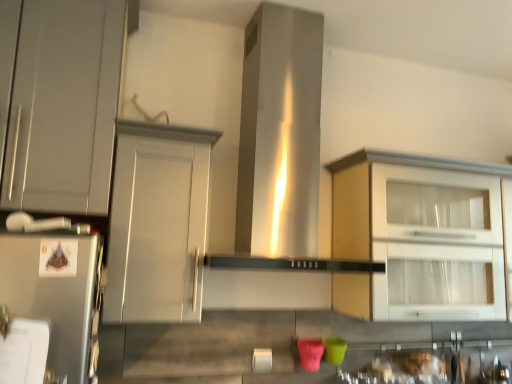
Image resolution: width=512 pixels, height=384 pixels. Describe the element at coordinates (64, 106) in the screenshot. I see `matte gray cabinet at left, which ranks as the 3th cabinetry in right-to-left order` at that location.

I want to click on matte white cabinet at right, placed as the 3th cabinetry when sorted from left to right, so 414,233.

Image resolution: width=512 pixels, height=384 pixels. What do you see at coordinates (414, 233) in the screenshot? I see `matte white cabinet at right, placed as the 3th cabinetry when sorted from left to right` at bounding box center [414, 233].

Find the location of a particular element. Image resolution: width=512 pixels, height=384 pixels. matte gray cabinet at left, the first cabinetry from the left is located at coordinates (64, 106).

Is stainless steel vent at center positioned far away from matte white cabinet at right, which is the first cabinetry from right to left?

No, stainless steel vent at center is in close proximity to matte white cabinet at right, which is the first cabinetry from right to left.

Is stainless steel vent at center aimed at matte white cabinet at right, placed as the 3th cabinetry when sorted from left to right?

No, stainless steel vent at center is not turned towards matte white cabinet at right, placed as the 3th cabinetry when sorted from left to right.

From the image's perspective, between stainless steel vent at center and matte white cabinet at right, placed as the 3th cabinetry when sorted from left to right, which one is located above?

From the image's view, stainless steel vent at center is above.

From a real-world perspective, is stainless steel vent at center physically below matte white cabinet at right, which is the first cabinetry from right to left?

No, from a real-world perspective, stainless steel vent at center is not below matte white cabinet at right, which is the first cabinetry from right to left.

Is matte gray cabinet at center, positioned as the second cabinetry in right-to-left order, located outside matte white cabinet at right, placed as the 3th cabinetry when sorted from left to right?

Yes, matte gray cabinet at center, positioned as the second cabinetry in right-to-left order, is located beyond the bounds of matte white cabinet at right, placed as the 3th cabinetry when sorted from left to right.

From the image's perspective, is matte gray cabinet at center, positioned as the 2th cabinetry in left-to-right order, under matte white cabinet at right, placed as the 3th cabinetry when sorted from left to right?

Actually, matte gray cabinet at center, positioned as the 2th cabinetry in left-to-right order, appears above matte white cabinet at right, placed as the 3th cabinetry when sorted from left to right, in the image.

What's the angular difference between matte gray cabinet at center, positioned as the second cabinetry in right-to-left order, and matte white cabinet at right, placed as the 3th cabinetry when sorted from left to right,'s facing directions?

2.21 degrees separate the facing orientations of matte gray cabinet at center, positioned as the second cabinetry in right-to-left order, and matte white cabinet at right, placed as the 3th cabinetry when sorted from left to right.

From the image's perspective, is matte gray cabinet at left, which ranks as the 3th cabinetry in right-to-left order, positioned above or below matte white cabinet at right, which is the first cabinetry from right to left?

matte gray cabinet at left, which ranks as the 3th cabinetry in right-to-left order, is above matte white cabinet at right, which is the first cabinetry from right to left.

Does matte gray cabinet at left, which ranks as the 3th cabinetry in right-to-left order, contain matte white cabinet at right, placed as the 3th cabinetry when sorted from left to right?

No, matte gray cabinet at left, which ranks as the 3th cabinetry in right-to-left order, does not contain matte white cabinet at right, placed as the 3th cabinetry when sorted from left to right.

From a real-world perspective, is matte gray cabinet at left, which ranks as the 3th cabinetry in right-to-left order, located higher than matte white cabinet at right, placed as the 3th cabinetry when sorted from left to right?

Correct, in the physical world, matte gray cabinet at left, which ranks as the 3th cabinetry in right-to-left order, is higher than matte white cabinet at right, placed as the 3th cabinetry when sorted from left to right.

Considering the positions of objects matte gray cabinet at left, the first cabinetry from the left, and matte white cabinet at right, placed as the 3th cabinetry when sorted from left to right, in the image provided, who is more to the right, matte gray cabinet at left, the first cabinetry from the left, or matte white cabinet at right, placed as the 3th cabinetry when sorted from left to right,?

matte white cabinet at right, placed as the 3th cabinetry when sorted from left to right, is more to the right.

The image size is (512, 384). Find the location of `the 1st cabinetry behind the matte gray cabinet at left, which ranks as the 3th cabinetry in right-to-left order`. the 1st cabinetry behind the matte gray cabinet at left, which ranks as the 3th cabinetry in right-to-left order is located at coordinates (158, 223).

Considering the relative sizes of matte gray cabinet at left, which ranks as the 3th cabinetry in right-to-left order, and matte gray cabinet at center, positioned as the second cabinetry in right-to-left order, in the image provided, is matte gray cabinet at left, which ranks as the 3th cabinetry in right-to-left order, smaller than matte gray cabinet at center, positioned as the second cabinetry in right-to-left order,?

Incorrect, matte gray cabinet at left, which ranks as the 3th cabinetry in right-to-left order, is not smaller in size than matte gray cabinet at center, positioned as the second cabinetry in right-to-left order.

Can you confirm if matte gray cabinet at left, which ranks as the 3th cabinetry in right-to-left order, is positioned to the left of matte gray cabinet at center, positioned as the second cabinetry in right-to-left order?

Yes.

From the picture: From the image's perspective, is matte gray cabinet at left, the first cabinetry from the left, located above or below matte gray cabinet at center, positioned as the second cabinetry in right-to-left order?

From the image's perspective, matte gray cabinet at left, the first cabinetry from the left, appears above matte gray cabinet at center, positioned as the second cabinetry in right-to-left order.

At what (x,y) coordinates should I click in order to perform the action: click on cabinetry behind the matte gray cabinet at center, positioned as the second cabinetry in right-to-left order. Please return your answer as a coordinate pair (x, y). Image resolution: width=512 pixels, height=384 pixels. Looking at the image, I should click on (414, 233).

Is matte white cabinet at right, placed as the 3th cabinetry when sorted from left to right, at the left side of matte gray cabinet at center, positioned as the second cabinetry in right-to-left order?

No.

Between point (436, 247) and point (129, 249), which one is positioned in front?

The point (129, 249) is more forward.

What's the angular difference between matte white cabinet at right, placed as the 3th cabinetry when sorted from left to right, and matte gray cabinet at center, positioned as the second cabinetry in right-to-left order,'s facing directions?

The angle between the facing direction of matte white cabinet at right, placed as the 3th cabinetry when sorted from left to right, and the facing direction of matte gray cabinet at center, positioned as the second cabinetry in right-to-left order, is 2.21 degrees.

From the image's perspective, between matte gray cabinet at left, the first cabinetry from the left, and stainless steel vent at center, which one is located above?

matte gray cabinet at left, the first cabinetry from the left, appears higher in the image.

Would you say matte gray cabinet at left, the first cabinetry from the left, is to the left or to the right of stainless steel vent at center in the picture?

From the image, it's evident that matte gray cabinet at left, the first cabinetry from the left, is to the left of stainless steel vent at center.

Considering the sizes of matte gray cabinet at left, the first cabinetry from the left, and stainless steel vent at center in the image, is matte gray cabinet at left, the first cabinetry from the left, taller or shorter than stainless steel vent at center?

In the image, matte gray cabinet at left, the first cabinetry from the left, appears to be shorter than stainless steel vent at center.

Locate an element on the screen. vent that appears below the matte gray cabinet at left, which ranks as the 3th cabinetry in right-to-left order (from the image's perspective) is located at coordinates (280, 133).

Can you confirm if stainless steel vent at center is positioned to the left of matte gray cabinet at left, which ranks as the 3th cabinetry in right-to-left order?

In fact, stainless steel vent at center is to the right of matte gray cabinet at left, which ranks as the 3th cabinetry in right-to-left order.

Considering the positions of objects stainless steel vent at center and matte gray cabinet at left, the first cabinetry from the left, in the image provided, who is behind, stainless steel vent at center or matte gray cabinet at left, the first cabinetry from the left,?

stainless steel vent at center is further from the camera.

Considering the sizes of objects stainless steel vent at center and matte gray cabinet at left, which ranks as the 3th cabinetry in right-to-left order, in the image provided, who is bigger, stainless steel vent at center or matte gray cabinet at left, which ranks as the 3th cabinetry in right-to-left order,?

stainless steel vent at center is bigger.

Considering the relative sizes of stainless steel vent at center and matte gray cabinet at left, the first cabinetry from the left, in the image provided, is stainless steel vent at center wider than matte gray cabinet at left, the first cabinetry from the left,?

Yes, stainless steel vent at center is wider than matte gray cabinet at left, the first cabinetry from the left.

You are a GUI agent. You are given a task and a screenshot of the screen. Output one action in this format:
    pyautogui.click(x=<x>, y=<y>)
    Task: Click on the vent on the left of matte white cabinet at right, which is the first cabinetry from right to left
    This screenshot has height=384, width=512.
    Given the screenshot: What is the action you would take?
    pyautogui.click(x=280, y=133)

Find the location of a particular element. The width and height of the screenshot is (512, 384). cabinetry behind the matte gray cabinet at center, positioned as the second cabinetry in right-to-left order is located at coordinates (414, 233).

When comparing their distances from matte white cabinet at right, placed as the 3th cabinetry when sorted from left to right, does matte gray cabinet at left, the first cabinetry from the left, or stainless steel vent at center seem closer?

stainless steel vent at center is closer to matte white cabinet at right, placed as the 3th cabinetry when sorted from left to right.

Which object lies further to the anchor point matte gray cabinet at left, which ranks as the 3th cabinetry in right-to-left order, stainless steel vent at center or matte white cabinet at right, which is the first cabinetry from right to left?

The object further to matte gray cabinet at left, which ranks as the 3th cabinetry in right-to-left order, is matte white cabinet at right, which is the first cabinetry from right to left.

Estimate the real-world distances between objects in this image. Which object is further from matte gray cabinet at left, the first cabinetry from the left, matte white cabinet at right, which is the first cabinetry from right to left, or stainless steel vent at center?

matte white cabinet at right, which is the first cabinetry from right to left.

From the image, which object appears to be farther from matte gray cabinet at center, positioned as the second cabinetry in right-to-left order, matte gray cabinet at left, the first cabinetry from the left, or stainless steel vent at center?

stainless steel vent at center is further to matte gray cabinet at center, positioned as the second cabinetry in right-to-left order.

When comparing their distances from matte gray cabinet at center, positioned as the 2th cabinetry in left-to-right order, does matte gray cabinet at left, the first cabinetry from the left, or matte white cabinet at right, placed as the 3th cabinetry when sorted from left to right, seem further?

matte white cabinet at right, placed as the 3th cabinetry when sorted from left to right, lies further to matte gray cabinet at center, positioned as the 2th cabinetry in left-to-right order, than the other object.

From the image, which object appears to be farther from matte white cabinet at right, placed as the 3th cabinetry when sorted from left to right, stainless steel vent at center or matte gray cabinet at center, positioned as the second cabinetry in right-to-left order?

matte gray cabinet at center, positioned as the second cabinetry in right-to-left order, is further to matte white cabinet at right, placed as the 3th cabinetry when sorted from left to right.

Which object lies nearer to the anchor point stainless steel vent at center, matte gray cabinet at left, which ranks as the 3th cabinetry in right-to-left order, or matte white cabinet at right, which is the first cabinetry from right to left?

matte white cabinet at right, which is the first cabinetry from right to left, is closer to stainless steel vent at center.

Looking at this image, from the image, which object appears to be farther from matte gray cabinet at center, positioned as the 2th cabinetry in left-to-right order, matte white cabinet at right, which is the first cabinetry from right to left, or stainless steel vent at center?

The object further to matte gray cabinet at center, positioned as the 2th cabinetry in left-to-right order, is matte white cabinet at right, which is the first cabinetry from right to left.

Identify the location of cabinetry located between matte gray cabinet at left, which ranks as the 3th cabinetry in right-to-left order, and matte white cabinet at right, placed as the 3th cabinetry when sorted from left to right, in the left-right direction. Image resolution: width=512 pixels, height=384 pixels. (158, 223).

I want to click on vent between matte gray cabinet at center, positioned as the 2th cabinetry in left-to-right order, and matte white cabinet at right, which is the first cabinetry from right to left, in the horizontal direction, so click(280, 133).

The height and width of the screenshot is (384, 512). What are the coordinates of `vent between matte gray cabinet at left, the first cabinetry from the left, and matte white cabinet at right, placed as the 3th cabinetry when sorted from left to right, from left to right` in the screenshot? It's located at (280, 133).

You are a GUI agent. You are given a task and a screenshot of the screen. Output one action in this format:
    pyautogui.click(x=<x>, y=<y>)
    Task: Click on the cabinetry located between matte gray cabinet at left, which ranks as the 3th cabinetry in right-to-left order, and stainless steel vent at center in the left-right direction
    The image size is (512, 384).
    Given the screenshot: What is the action you would take?
    pyautogui.click(x=158, y=223)